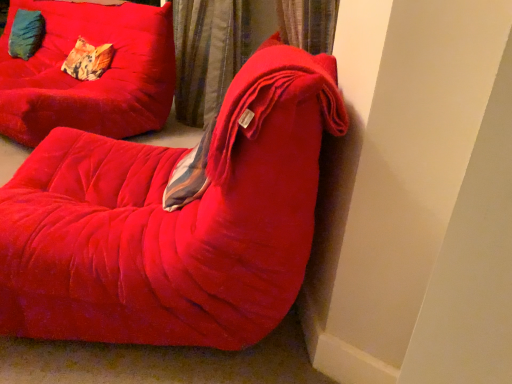
Measure the distance between velvet cushion at upper left, marked as the second pillow in a front-to-back arrangement, and camera.

A distance of 3.29 meters exists between velvet cushion at upper left, marked as the second pillow in a front-to-back arrangement, and camera.

The image size is (512, 384). Find the location of `patterned fabric pillow at upper left, which appears as the 1th pillow when viewed from the right`. patterned fabric pillow at upper left, which appears as the 1th pillow when viewed from the right is located at coordinates (88, 60).

Where is `curtain above the patterned fabric pillow at upper left, the 2th pillow in the back-to-front sequence (from a real-world perspective)`? This screenshot has height=384, width=512. curtain above the patterned fabric pillow at upper left, the 2th pillow in the back-to-front sequence (from a real-world perspective) is located at coordinates (208, 54).

Considering the relative sizes of velvet curtain at upper center and patterned fabric pillow at upper left, which is counted as the 1th pillow, starting from the front, in the image provided, is velvet curtain at upper center wider than patterned fabric pillow at upper left, which is counted as the 1th pillow, starting from the front,?

Yes.

Is velvet curtain at upper center further to camera compared to patterned fabric pillow at upper left, which appears as the 1th pillow when viewed from the right?

No, velvet curtain at upper center is closer to the viewer.

From a real-world perspective, is velvet curtain at upper center above or below patterned fabric pillow at upper left, which is counted as the 1th pillow, starting from the front?

Answer: velvet curtain at upper center is situated higher than patterned fabric pillow at upper left, which is counted as the 1th pillow, starting from the front, in the real world.

Is patterned fabric pillow at upper left, which appears as the 1th pillow when viewed from the right, directly adjacent to velvet cushion at upper left, which is the 2th pillow in right-to-left order?

There is a gap between patterned fabric pillow at upper left, which appears as the 1th pillow when viewed from the right, and velvet cushion at upper left, which is the 2th pillow in right-to-left order.

Find the location of a particular element. This screenshot has height=384, width=512. pillow on the right of velvet cushion at upper left, which is the 2th pillow in right-to-left order is located at coordinates (88, 60).

From a real-world perspective, is patterned fabric pillow at upper left, which is counted as the 1th pillow, starting from the front, physically located above or below velvet cushion at upper left, which appears as the 1th pillow when viewed from the left?

patterned fabric pillow at upper left, which is counted as the 1th pillow, starting from the front, is situated lower than velvet cushion at upper left, which appears as the 1th pillow when viewed from the left, in the real world.

Can you confirm if patterned fabric pillow at upper left, which is counted as the 1th pillow, starting from the front, is positioned to the right of velvet cushion at upper left, marked as the second pillow in a front-to-back arrangement?

Correct, you'll find patterned fabric pillow at upper left, which is counted as the 1th pillow, starting from the front, to the right of velvet cushion at upper left, marked as the second pillow in a front-to-back arrangement.

Identify the location of furniture behind the velvet red chair at center, which is counted as the 2th furniture, starting from the back. (89, 81).

Based on the photo, is velvet red couch at center, positioned as the second furniture in front-to-back order, situated inside velvet red chair at center, which is counted as the 2th furniture, starting from the back, or outside?

velvet red couch at center, positioned as the second furniture in front-to-back order, is not enclosed by velvet red chair at center, which is counted as the 2th furniture, starting from the back.

From the image's perspective, is velvet red couch at center, which is the first furniture in back-to-front order, positioned above or below velvet red chair at center, which is counted as the first furniture, starting from the front?

velvet red couch at center, which is the first furniture in back-to-front order, is above velvet red chair at center, which is counted as the first furniture, starting from the front.

Considering the relative sizes of velvet red couch at center, positioned as the second furniture in front-to-back order, and velvet red chair at center, which is counted as the 2th furniture, starting from the back, in the image provided, is velvet red couch at center, positioned as the second furniture in front-to-back order, bigger than velvet red chair at center, which is counted as the 2th furniture, starting from the back,?

Correct, velvet red couch at center, positioned as the second furniture in front-to-back order, is larger in size than velvet red chair at center, which is counted as the 2th furniture, starting from the back.

Is velvet red couch at center, which is the first furniture in back-to-front order, taller or shorter than velvet cushion at upper left, which appears as the 1th pillow when viewed from the left?

Considering their sizes, velvet red couch at center, which is the first furniture in back-to-front order, has more height than velvet cushion at upper left, which appears as the 1th pillow when viewed from the left.

Is velvet red couch at center, positioned as the second furniture in front-to-back order, closer to camera compared to velvet cushion at upper left, which is the 2th pillow in right-to-left order?

Yes.

This screenshot has height=384, width=512. Find the location of `the 1st furniture positioned below the velvet cushion at upper left, which appears as the 1th pillow when viewed from the left (from the image's perspective)`. the 1st furniture positioned below the velvet cushion at upper left, which appears as the 1th pillow when viewed from the left (from the image's perspective) is located at coordinates (89, 81).

Is velvet red couch at center, positioned as the second furniture in front-to-back order, positioned with its back to velvet cushion at upper left, marked as the second pillow in a front-to-back arrangement?

Yes, velvet cushion at upper left, marked as the second pillow in a front-to-back arrangement, is at the back of velvet red couch at center, positioned as the second furniture in front-to-back order.

Which of these two, velvet curtain at upper center or velvet red couch at center, positioned as the second furniture in front-to-back order, is thinner?

velvet curtain at upper center.

From a real-world perspective, is velvet curtain at upper center on velvet red couch at center, which is the first furniture in back-to-front order?

Indeed, from a real-world perspective, velvet curtain at upper center stands above velvet red couch at center, which is the first furniture in back-to-front order.

Is velvet curtain at upper center next to velvet red couch at center, positioned as the second furniture in front-to-back order?

No, velvet curtain at upper center is not in contact with velvet red couch at center, positioned as the second furniture in front-to-back order.

From the image's perspective, which object appears higher, velvet cushion at upper left, marked as the 1th pillow in a back-to-front arrangement, or velvet red couch at center, positioned as the second furniture in front-to-back order?

velvet cushion at upper left, marked as the 1th pillow in a back-to-front arrangement, is shown above in the image.

Is velvet cushion at upper left, which is the 2th pillow in right-to-left order, bigger than velvet red couch at center, positioned as the second furniture in front-to-back order?

No.

Based on the photo, from a real-world perspective, between velvet cushion at upper left, marked as the second pillow in a front-to-back arrangement, and velvet red couch at center, which is the first furniture in back-to-front order, who is vertically higher?

In real-world perspective, velvet cushion at upper left, marked as the second pillow in a front-to-back arrangement, is above.

Is velvet cushion at upper left, marked as the second pillow in a front-to-back arrangement, oriented towards velvet red couch at center, positioned as the second furniture in front-to-back order?

Yes, velvet cushion at upper left, marked as the second pillow in a front-to-back arrangement, is oriented towards velvet red couch at center, positioned as the second furniture in front-to-back order.

How many degrees apart are the facing directions of velvet cushion at upper left, marked as the 1th pillow in a back-to-front arrangement, and patterned fabric pillow at upper left, which is counted as the 1th pillow, starting from the front?

The angular difference between velvet cushion at upper left, marked as the 1th pillow in a back-to-front arrangement, and patterned fabric pillow at upper left, which is counted as the 1th pillow, starting from the front, is 0.451 degrees.

Consider the image. From a real-world perspective, who is located lower, velvet cushion at upper left, which appears as the 1th pillow when viewed from the left, or patterned fabric pillow at upper left, the 2th pillow in the back-to-front sequence?

In real-world perspective, patterned fabric pillow at upper left, the 2th pillow in the back-to-front sequence, is lower.

Is the depth of velvet cushion at upper left, marked as the second pillow in a front-to-back arrangement, greater than that of patterned fabric pillow at upper left, the 2th pillow in the back-to-front sequence?

Yes, velvet cushion at upper left, marked as the second pillow in a front-to-back arrangement, is further from the viewer.

Which is more to the left, velvet cushion at upper left, which appears as the 1th pillow when viewed from the left, or patterned fabric pillow at upper left, positioned as the 2th pillow in left-to-right order?

velvet cushion at upper left, which appears as the 1th pillow when viewed from the left.

In the image, there is a patterned fabric pillow at upper left, positioned as the 2th pillow in left-to-right order. At what (x,y) coordinates should I click in order to perform the action: click on curtain below it (from the image's perspective). Please return your answer as a coordinate pair (x, y). The image size is (512, 384). Looking at the image, I should click on pyautogui.click(x=208, y=54).

Locate an element on the screen. pillow beneath the velvet cushion at upper left, marked as the 1th pillow in a back-to-front arrangement (from a real-world perspective) is located at coordinates (88, 60).

Based on their spatial positions, is patterned fabric pillow at upper left, the 2th pillow in the back-to-front sequence, or velvet red chair at center, which is counted as the 2th furniture, starting from the back, further from velvet curtain at upper center?

The object further to velvet curtain at upper center is velvet red chair at center, which is counted as the 2th furniture, starting from the back.

Which object lies nearer to the anchor point patterned fabric pillow at upper left, positioned as the 2th pillow in left-to-right order, velvet curtain at upper center or velvet red chair at center, which is counted as the 2th furniture, starting from the back?

The object closer to patterned fabric pillow at upper left, positioned as the 2th pillow in left-to-right order, is velvet curtain at upper center.

Considering their positions, is velvet red couch at center, which is the first furniture in back-to-front order, positioned closer to velvet curtain at upper center than patterned fabric pillow at upper left, positioned as the 2th pillow in left-to-right order?

The object closer to velvet curtain at upper center is velvet red couch at center, which is the first furniture in back-to-front order.

Estimate the real-world distances between objects in this image. Which object is closer to velvet red chair at center, which is counted as the 2th furniture, starting from the back, velvet curtain at upper center or patterned fabric pillow at upper left, positioned as the 2th pillow in left-to-right order?

The object closer to velvet red chair at center, which is counted as the 2th furniture, starting from the back, is velvet curtain at upper center.

From the image, which object appears to be farther from velvet cushion at upper left, marked as the 1th pillow in a back-to-front arrangement, velvet red couch at center, which is the first furniture in back-to-front order, or velvet red chair at center, which is counted as the 2th furniture, starting from the back?

Among the two, velvet red chair at center, which is counted as the 2th furniture, starting from the back, is located further to velvet cushion at upper left, marked as the 1th pillow in a back-to-front arrangement.

Based on their spatial positions, is patterned fabric pillow at upper left, the 2th pillow in the back-to-front sequence, or velvet cushion at upper left, which is the 2th pillow in right-to-left order, closer to velvet curtain at upper center?

patterned fabric pillow at upper left, the 2th pillow in the back-to-front sequence, is positioned closer to the anchor velvet curtain at upper center.

Looking at the image, which one is located further to velvet curtain at upper center, velvet cushion at upper left, marked as the second pillow in a front-to-back arrangement, or patterned fabric pillow at upper left, which appears as the 1th pillow when viewed from the right?

velvet cushion at upper left, marked as the second pillow in a front-to-back arrangement.

Based on their spatial positions, is velvet cushion at upper left, which appears as the 1th pillow when viewed from the left, or velvet red couch at center, which is the first furniture in back-to-front order, further from velvet curtain at upper center?

velvet cushion at upper left, which appears as the 1th pillow when viewed from the left.

Where is `pillow situated between velvet red couch at center, which is the first furniture in back-to-front order, and velvet curtain at upper center from left to right`? The width and height of the screenshot is (512, 384). pillow situated between velvet red couch at center, which is the first furniture in back-to-front order, and velvet curtain at upper center from left to right is located at coordinates (88, 60).

Find the location of a particular element. The image size is (512, 384). curtain located between velvet red chair at center, which is counted as the 2th furniture, starting from the back, and velvet cushion at upper left, which appears as the 1th pillow when viewed from the left, in the depth direction is located at coordinates (208, 54).

This screenshot has height=384, width=512. What are the coordinates of `pillow located between velvet red chair at center, which is counted as the first furniture, starting from the front, and velvet cushion at upper left, which appears as the 1th pillow when viewed from the left, in the depth direction` in the screenshot? It's located at (88, 60).

Where is `furniture located between velvet red chair at center, which is counted as the first furniture, starting from the front, and patterned fabric pillow at upper left, which is counted as the 1th pillow, starting from the front, in the depth direction`? This screenshot has width=512, height=384. furniture located between velvet red chair at center, which is counted as the first furniture, starting from the front, and patterned fabric pillow at upper left, which is counted as the 1th pillow, starting from the front, in the depth direction is located at coordinates (89, 81).